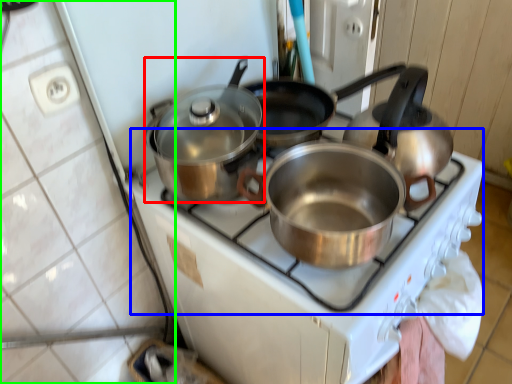
Question: Based on their relative distances, which object is farther from kitchen appliance (highlighted by a red box)? Choose from gas stove (highlighted by a blue box) and tile (highlighted by a green box).

Choices:
 (A) gas stove
 (B) tile

Answer: (B)